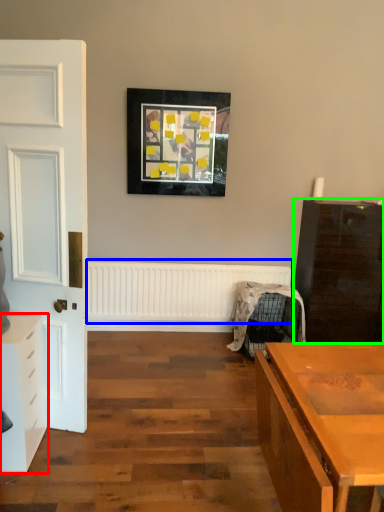
Question: Which is farther away from chest of drawers (highlighted by a red box)? radiator (highlighted by a blue box) or chest of drawers (highlighted by a green box)?

Choices:
 (A) radiator
 (B) chest of drawers

Answer: (B)